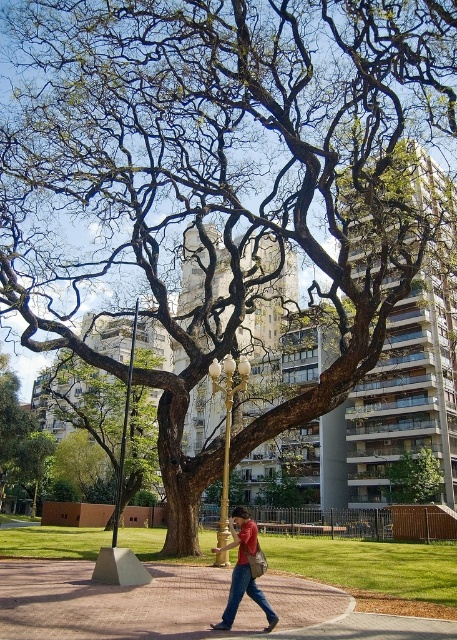
Question: Which point appears closest to the camera in this image?

Choices:
 (A) (153, 365)
 (B) (256, 600)
 (C) (393, 476)
 (D) (296, 625)

Answer: (B)

Question: Based on their relative distances, which object is farther from the smooth brown tree trunk at center?

Choices:
 (A) green leafy tree at center
 (B) matte red shirt at center
 (C) paved brick sidewalk at center

Answer: (A)

Question: Does paved brick sidewalk at center appear over matte red shirt at center?

Choices:
 (A) yes
 (B) no

Answer: (B)

Question: Which object is positioned closest to the matte red shirt at center?

Choices:
 (A) green leafy tree at center
 (B) paved brick sidewalk at center
 (C) smooth brown tree trunk at center

Answer: (B)

Question: Does smooth brown tree trunk at center appear over matte red shirt at center?

Choices:
 (A) no
 (B) yes

Answer: (A)

Question: Considering the relative positions of paved brick sidewalk at center and matte red shirt at center in the image provided, where is paved brick sidewalk at center located with respect to matte red shirt at center?

Choices:
 (A) left
 (B) right

Answer: (A)